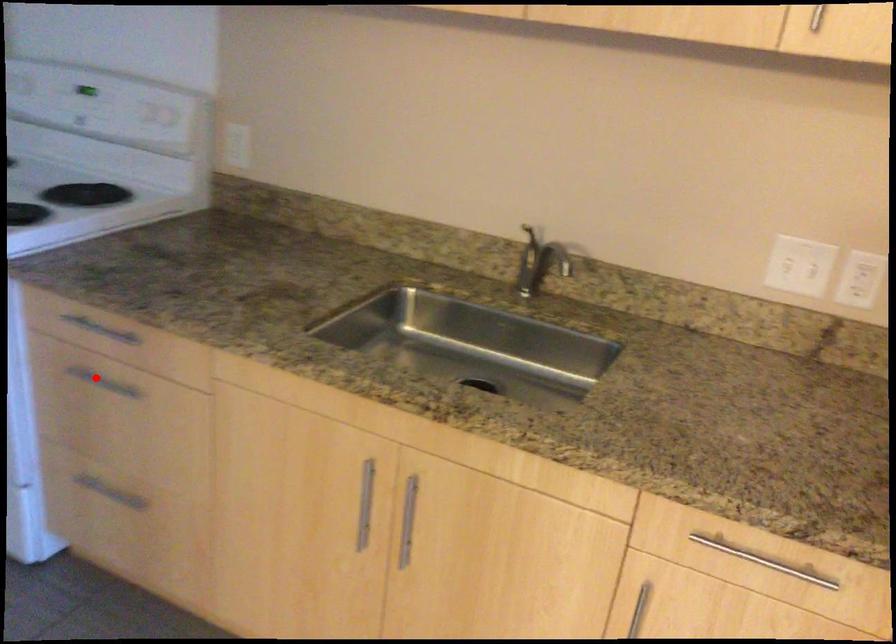
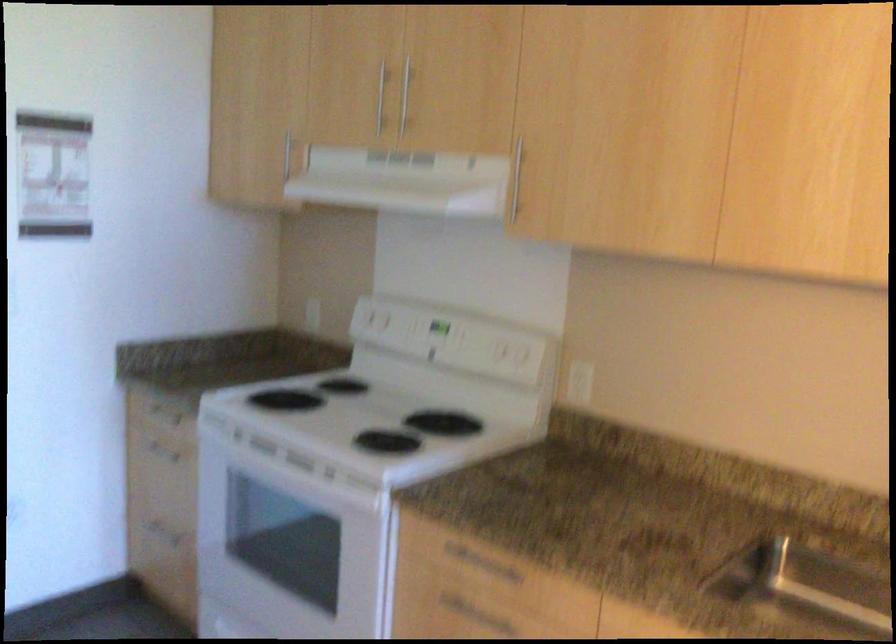
Find the pixel in the second image that matches the highlighted location in the first image.

(466, 609)